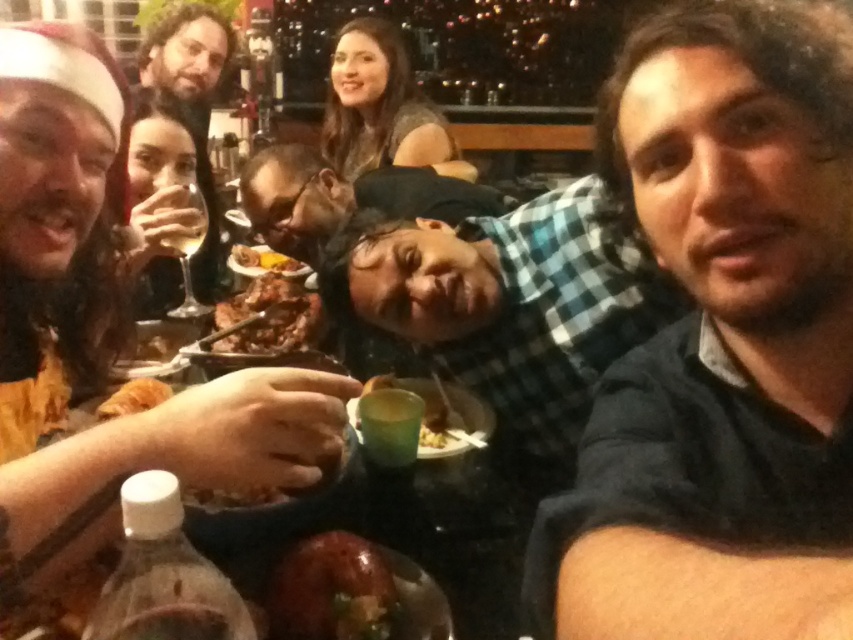
Is translucent plastic cup at center taller than yellow cheese sauce at center?

Yes.

Which is in front, point (401, 387) or point (263, 268)?

Positioned in front is point (401, 387).

In the scene shown: Who is more forward, (466, 416) or (294, 260)?

Positioned in front is point (466, 416).

Where is `translucent plastic cup at center`? This screenshot has width=853, height=640. translucent plastic cup at center is located at coordinates (450, 404).

Does dark blue shirt at center have a greater height compared to yellow cheese sauce at center?

Yes.

Between dark blue shirt at center and yellow cheese sauce at center, which one has less height?

yellow cheese sauce at center

Is point (660, 36) positioned in front of point (281, 257)?

Yes, it is in front of point (281, 257).

Image resolution: width=853 pixels, height=640 pixels. Find the location of `dark blue shirt at center`. dark blue shirt at center is located at coordinates (721, 342).

Who is taller, dark blue shirt at center or matte black wine glass at upper left?

Standing taller between the two is matte black wine glass at upper left.

Is dark blue shirt at center further to camera compared to matte black wine glass at upper left?

That is False.

At what (x,y) coordinates should I click in order to perform the action: click on dark blue shirt at center. Please return your answer as a coordinate pair (x, y). Looking at the image, I should click on (721, 342).